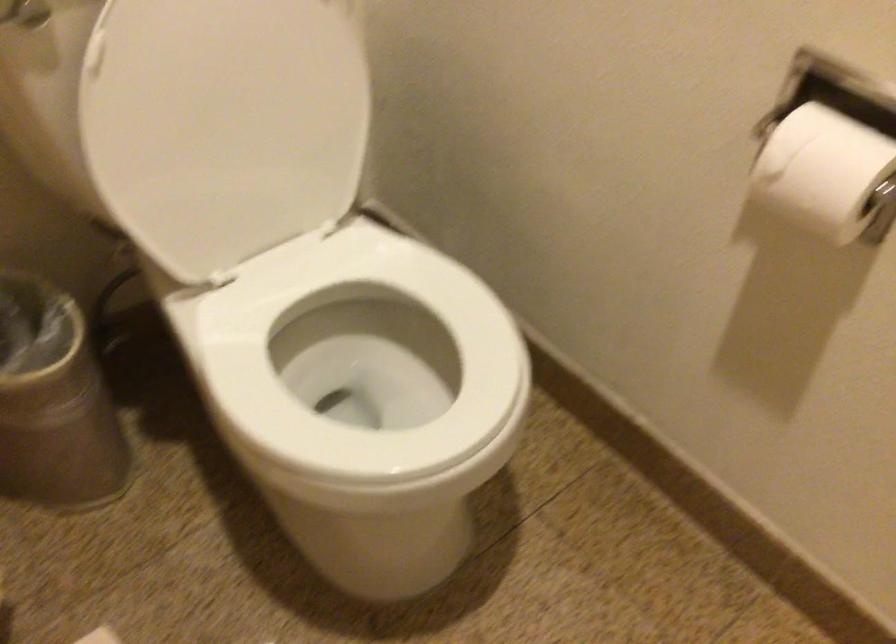
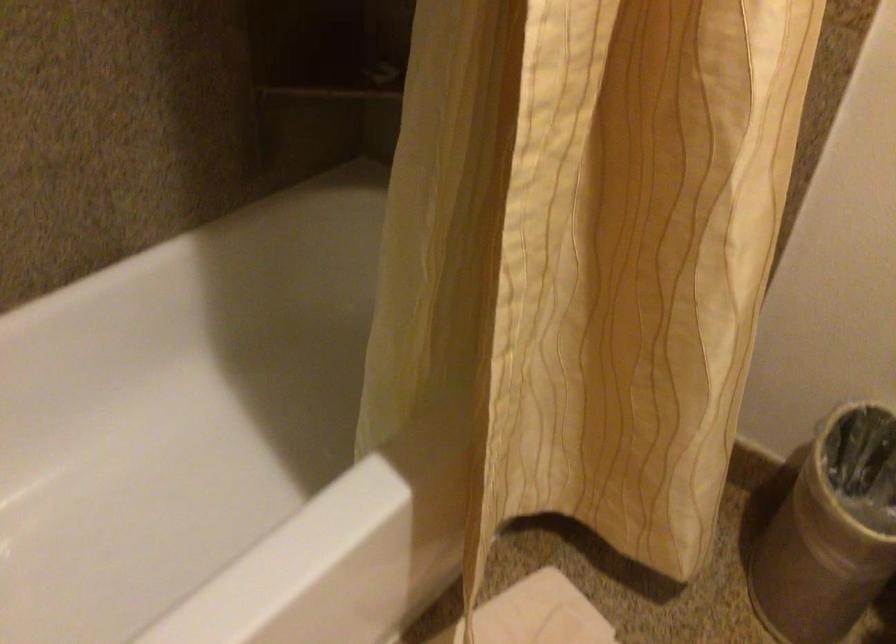
First-person continuous shooting, in which direction is the camera rotating?

The camera rotated toward left-down.